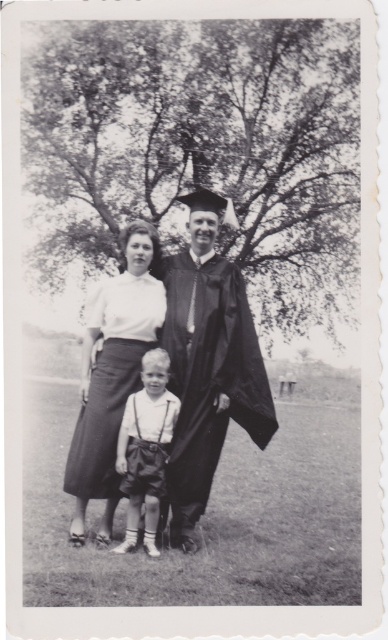
You are a photographer trying to capture a closeup of the smooth white shirt at center without the matte black graduation gown at center blocking it. Can you move to the left side of the scene to achieve this?

The matte black graduation gown at center is positioned on the right side of smooth white shirt at center. Moving to the left side of the scene would place the photographer to the left of both objects, potentially allowing the smooth white shirt at center to be visible without obstruction from the gown.

You are a photographer at a graduation ceremony. You need to arrange the two graduates so that their gowns and blouses are visible. The matte black graduation gown at center and the matte white blouse at center are currently in a position where the gown is on the right side of the blouse. Which graduate should move to the left to allow both to be seen clearly?

The matte white blouse at center should move to the left because the matte black graduation gown at center is currently positioned on the right side of it, so moving the blouse left would create space for both to be visible.

You are a photographer setting up for a graduation photo. You need to ensure that the matte black graduation gown at center and the matte white blouse at center are both visible in the frame. Given their sizes, which one might require more space in the shot?

The matte black graduation gown at center has a larger width than the matte white blouse at center, so it would require more space in the shot to ensure it is fully visible.